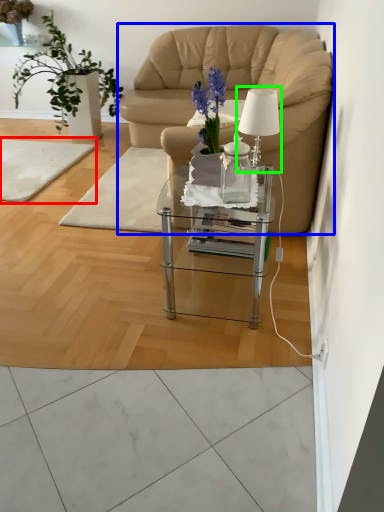
Question: Estimate the real-world distances between objects in this image. Which object is closer to mat (highlighted by a red box), chair (highlighted by a blue box) or table lamp (highlighted by a green box)?

Choices:
 (A) chair
 (B) table lamp

Answer: (A)